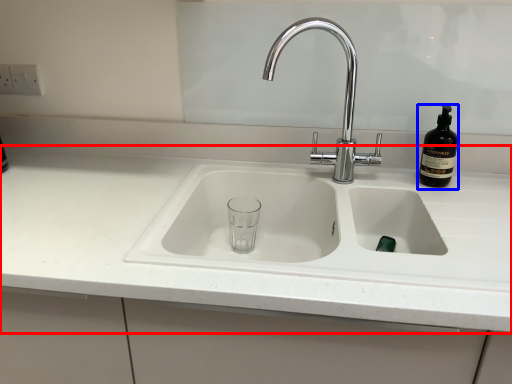
Question: Which point is further to the camera, countertop (highlighted by a red box) or bottle (highlighted by a blue box)?

Choices:
 (A) countertop
 (B) bottle

Answer: (B)